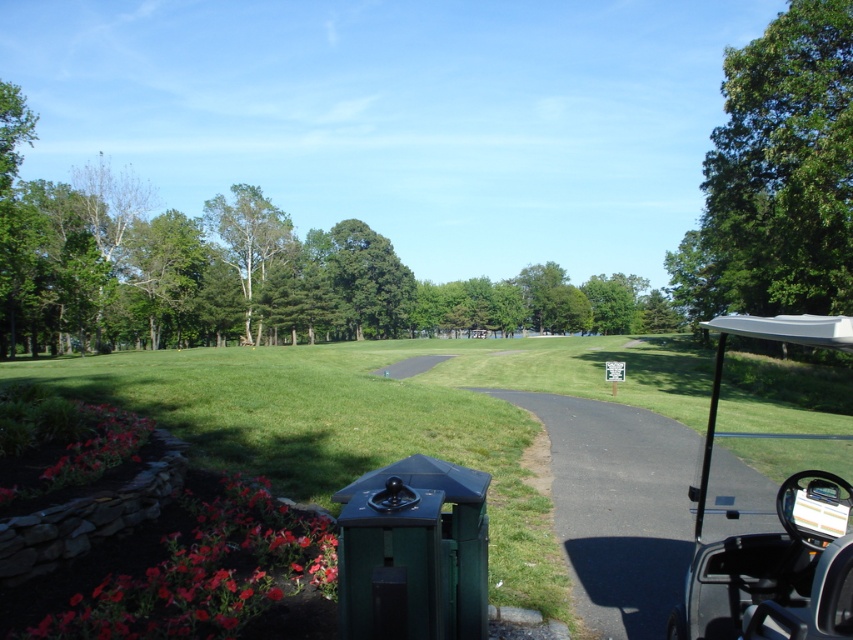
You are standing on the paved pathway and looking towards the trees. Which tree, the green leafy tree at upper right or the green leafy tree at upper center, appears closer to you?

The green leafy tree at upper right appears closer because it is in front of the green leafy tree at upper center.

You are a golfer standing at the point with coordinates (390, 417). What is the terrain you are currently standing on?

The terrain at point (390, 417) is the green matte golf course at center.

You are a landscape architect planning to add a new tree between the green leafy tree at upper right and the green leafy tree at upper center. Based on their current widths, which existing tree should the new tree be closer to in terms of width?

The new tree should be closer in width to the green leafy tree at upper right since it has a lesser width compared to the green leafy tree at upper center.